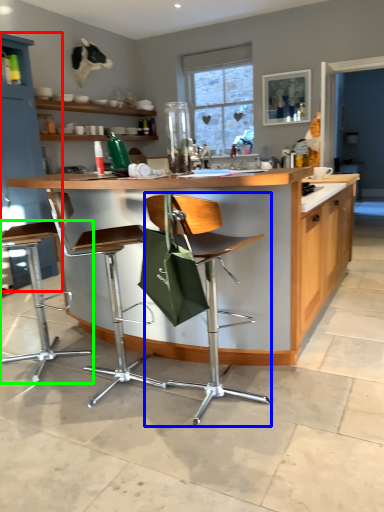
Question: Which is farther away from cabinetry (highlighted by a red box)? chair (highlighted by a blue box) or chair (highlighted by a green box)?

Choices:
 (A) chair
 (B) chair

Answer: (A)